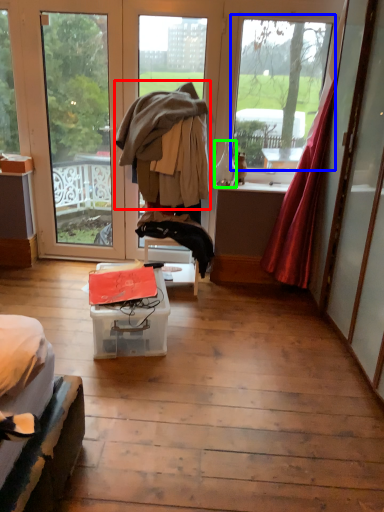
Question: Which object is positioned closest to jacket (highlighted by a red box)? Select from window (highlighted by a blue box) and bottle (highlighted by a green box).

Choices:
 (A) window
 (B) bottle

Answer: (B)